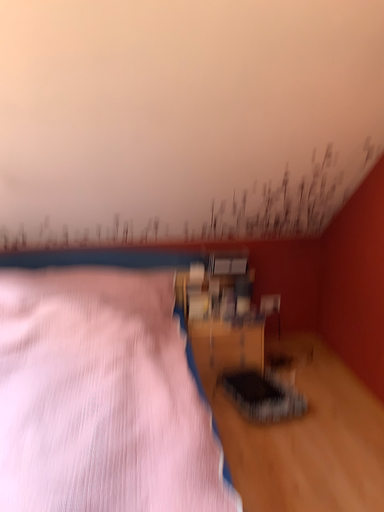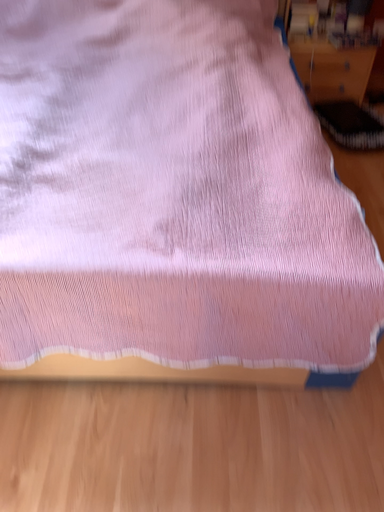
Question: How did the camera likely rotate when shooting the video?

Choices:
 (A) rotated downward
 (B) rotated upward

Answer: (A)